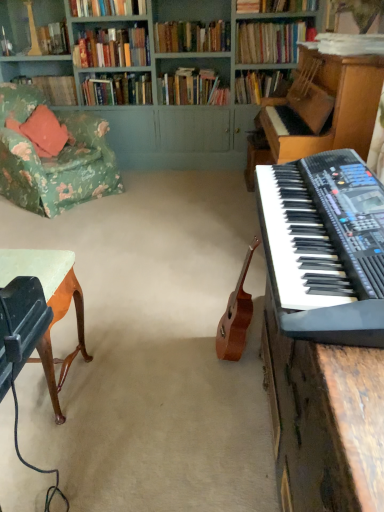
The image size is (384, 512). What are the coordinates of `vacant space in front of light brown wood desk at lower left` in the screenshot? It's located at (47, 455).